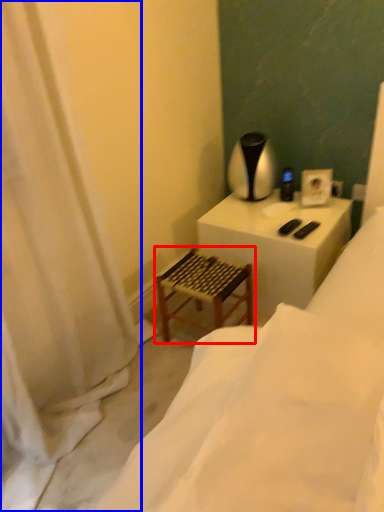
Question: Which point is closer to the camera, step stool (highlighted by a red box) or curtain (highlighted by a blue box)?

Choices:
 (A) step stool
 (B) curtain

Answer: (B)